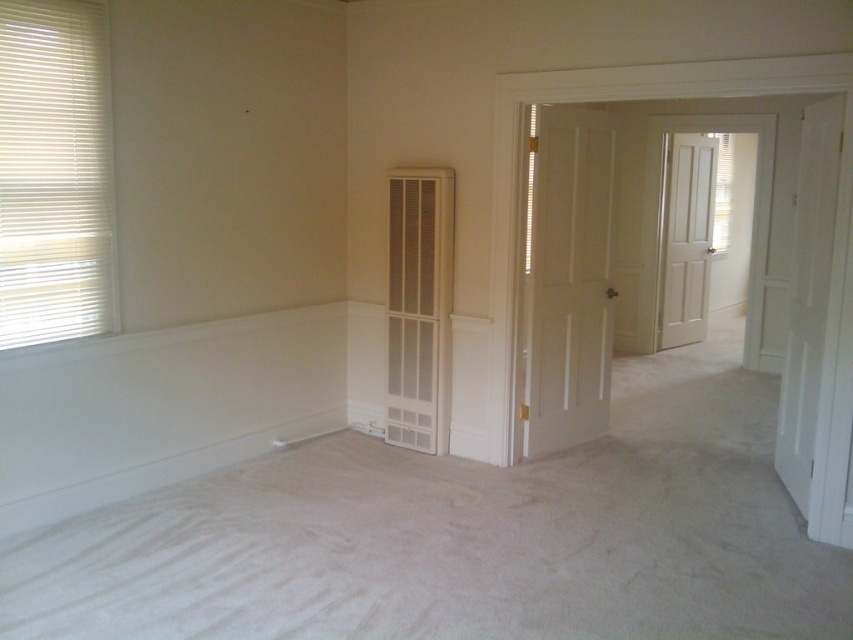
Does white blinds at left appear under white matte door at center?

No, white blinds at left is not below white matte door at center.

From the picture: Is white blinds at left closer to the viewer compared to white matte door at center?

Yes, white blinds at left is in front of white matte door at center.

Locate an element on the screen. The image size is (853, 640). white blinds at left is located at coordinates (55, 173).

Can you confirm if white blinds at left is wider than white matte door at center right?

Incorrect, white blinds at left's width does not surpass white matte door at center right's.

Is white blinds at left positioned before white matte door at center right?

Yes.

Is point (49, 38) positioned in front of point (701, 321)?

Yes, point (49, 38) is in front of point (701, 321).

Locate an element on the screen. The width and height of the screenshot is (853, 640). white blinds at left is located at coordinates (55, 173).

Which is below, white matte door at center or white matte door at center right?

white matte door at center is lower down.

Does white matte door at center appear over white matte door at center right?

Actually, white matte door at center is below white matte door at center right.

Does point (572, 300) lie behind point (697, 244)?

No, it is in front of (697, 244).

In order to click on white matte door at center in this screenshot , I will do `click(569, 280)`.